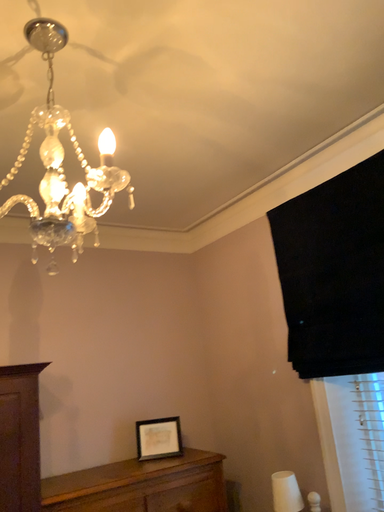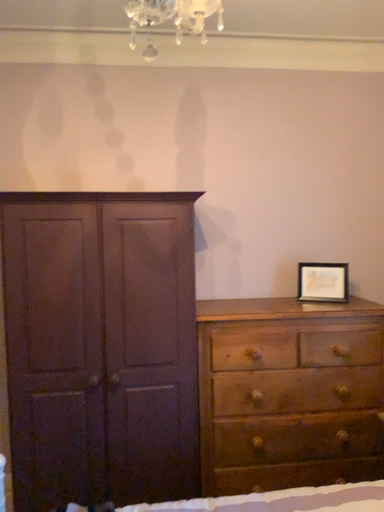
Question: How did the camera likely rotate when shooting the video?

Choices:
 (A) rotated right
 (B) rotated left

Answer: (B)